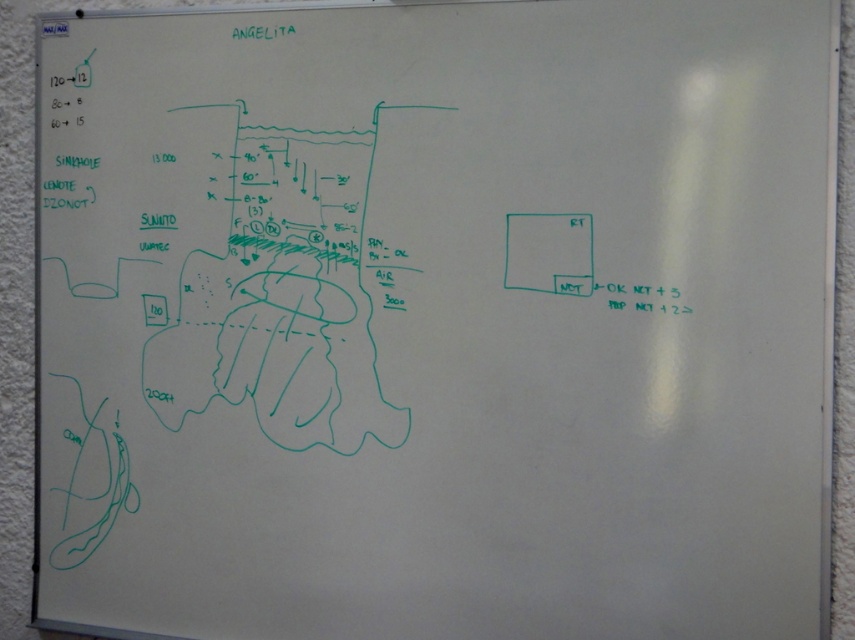
Between white paper at right and black ink at right, which one appears on the right side from the viewer's perspective?

black ink at right is more to the right.

Between white paper at right and black ink at right, which one has less height?

black ink at right

Who is more distant from viewer, (575, 243) or (662, 308)?

Point (575, 243)

Where is `white paper at right`? This screenshot has width=855, height=640. white paper at right is located at coordinates (549, 252).